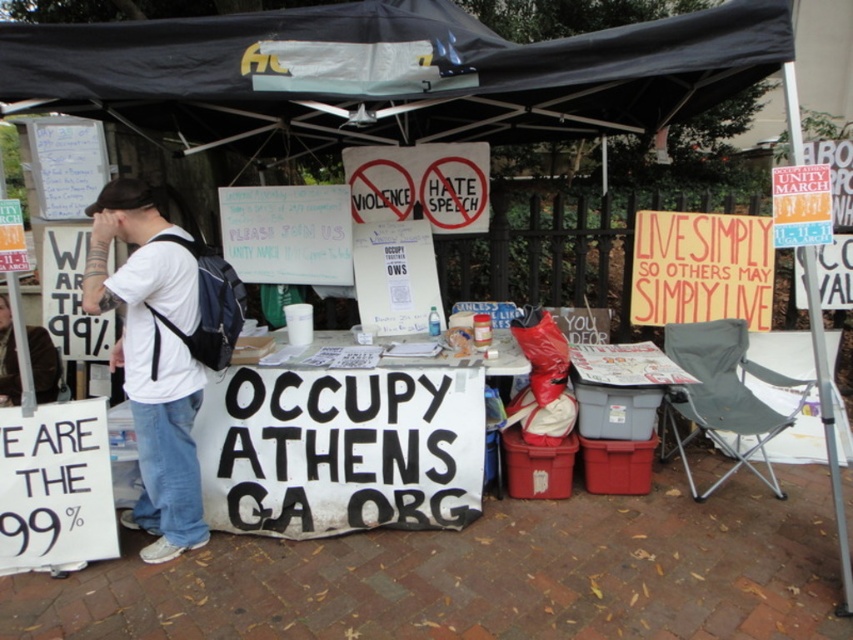
Question: Which of the following is the closest to the observer?

Choices:
 (A) white t-shirt at left
 (B) black fabric canopy at upper center

Answer: (B)

Question: Can you confirm if black fabric canopy at upper center is positioned to the right of white t-shirt at left?

Choices:
 (A) yes
 (B) no

Answer: (A)

Question: Is black fabric canopy at upper center further to camera compared to white t-shirt at left?

Choices:
 (A) no
 (B) yes

Answer: (A)

Question: From the image, what is the correct spatial relationship of black fabric canopy at upper center in relation to white t-shirt at left?

Choices:
 (A) right
 (B) left

Answer: (A)